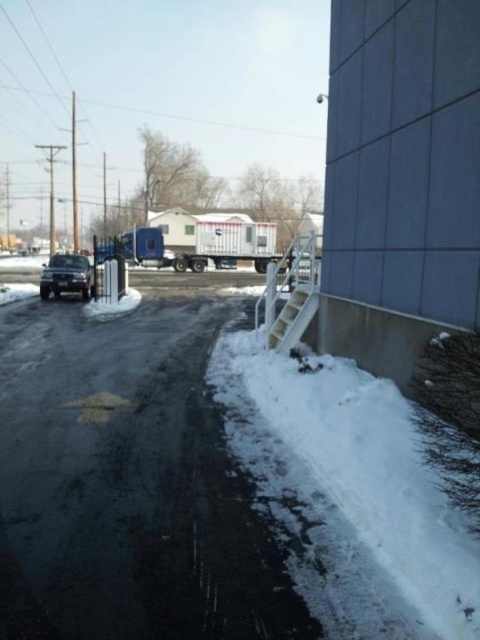
The height and width of the screenshot is (640, 480). In order to click on white fluffy snow at lower right in this screenshot , I will do `click(348, 492)`.

Who is more forward, (267, 458) or (52, 259)?

Point (267, 458) is in front.

Which is behind, point (406, 420) or point (84, 262)?

Positioned behind is point (84, 262).

The width and height of the screenshot is (480, 640). I want to click on white fluffy snow at lower right, so click(x=348, y=492).

Is white fluffy snow at lower right thinner than white plastic trailer truck at center?

Yes, white fluffy snow at lower right is thinner than white plastic trailer truck at center.

Who is lower down, white fluffy snow at lower right or white plastic trailer truck at center?

white fluffy snow at lower right is below.

You are a GUI agent. You are given a task and a screenshot of the screen. Output one action in this format:
    pyautogui.click(x=<x>, y=<y>)
    Task: Click on the white fluffy snow at lower right
    Image resolution: width=480 pixels, height=640 pixels.
    Given the screenshot: What is the action you would take?
    pyautogui.click(x=348, y=492)

Which of these two, white plastic trailer truck at center or shiny black sedan at left, stands taller?

Standing taller between the two is white plastic trailer truck at center.

Does point (192, 248) lie in front of point (78, 280)?

No, (192, 248) is further to viewer.

Does point (225, 220) lie behind point (51, 275)?

Yes, it is behind point (51, 275).

Where is `white plastic trailer truck at center`? Image resolution: width=480 pixels, height=640 pixels. white plastic trailer truck at center is located at coordinates (228, 243).